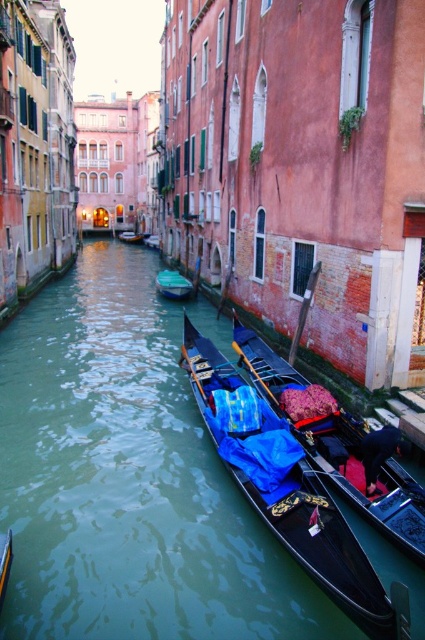
You are a tourist standing on the dock and want to take a photo of the green smooth water at center and the black glossy canoe at center. Which object should you focus on first if you want to capture both in the same frame without moving your camera?

You should focus on the green smooth water at center first because it is in front of the black glossy canoe at center, so keeping it in focus will ensure both are visible in the frame.

You are standing on the left bank of the canal and want to board the closest boat to you. Which boat should you choose between the black glossy canoe at center and the green plastic boat at center?

The black glossy canoe at center is closer to the viewer than the green plastic boat at center, so you should choose the black glossy canoe at center.

In the scene shown: You are a tourist in Venice and want to take a photo of the green plastic boat at center. Since the green smooth water at center is in the way, can you move the boat to the side to get a clear shot?

The green smooth water at center is larger than the green plastic boat at center, so moving the boat to the side might be possible as the water area is bigger, allowing space for repositioning the boat for a clearer photo.